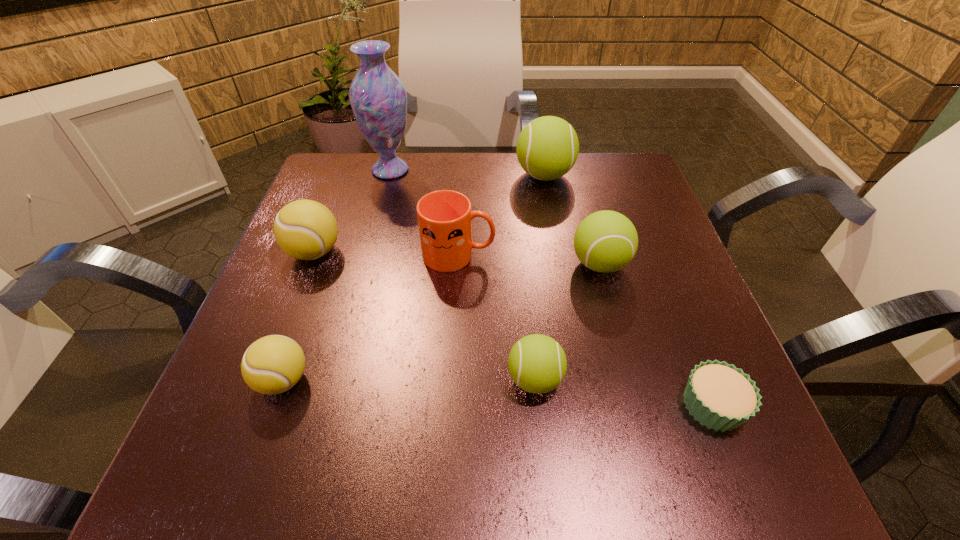
Find the location of a particular element. green tennis ball object that ranks as the second closest to the purple vase is located at coordinates (606, 241).

Locate an element on the screen. The width and height of the screenshot is (960, 540). vacant space that satisfies the following two spatial constraints: 1. on the handle side of the fourth object from left to right; 2. on the back side of the second biggest green tennis ball is located at coordinates (x=458, y=264).

The height and width of the screenshot is (540, 960). I want to click on free space that satisfies the following two spatial constraints: 1. on the handle side of the fifth object from right to left; 2. on the left side of the nearest green tennis ball, so click(x=452, y=379).

At what (x,y) coordinates should I click in order to perform the action: click on vacant area in the image that satisfies the following two spatial constraints: 1. on the back side of the purple vase; 2. on the right side of the nearer yellow tennis ball. Please return your answer as a coordinate pair (x, y). Looking at the image, I should click on [357, 170].

Find the location of a particular element. vacant space that satisfies the following two spatial constraints: 1. on the front side of the shortest object; 2. on the right side of the nearer yellow tennis ball is located at coordinates (275, 406).

Locate an element on the screen. The height and width of the screenshot is (540, 960). vacant region that satisfies the following two spatial constraints: 1. on the front side of the rightmost object; 2. on the right side of the bigger yellow tennis ball is located at coordinates (255, 406).

Locate an element on the screen. The width and height of the screenshot is (960, 540). free space in the image that satisfies the following two spatial constraints: 1. on the front side of the vase; 2. on the left side of the second nearest green tennis ball is located at coordinates (366, 264).

Identify the location of vacant area that satisfies the following two spatial constraints: 1. on the front side of the second nearest green tennis ball; 2. on the right side of the vase. (366, 264).

Image resolution: width=960 pixels, height=540 pixels. In order to click on vacant space that satisfies the following two spatial constraints: 1. on the front side of the purple vase; 2. on the right side of the second biggest green tennis ball in this screenshot , I will do `click(366, 264)`.